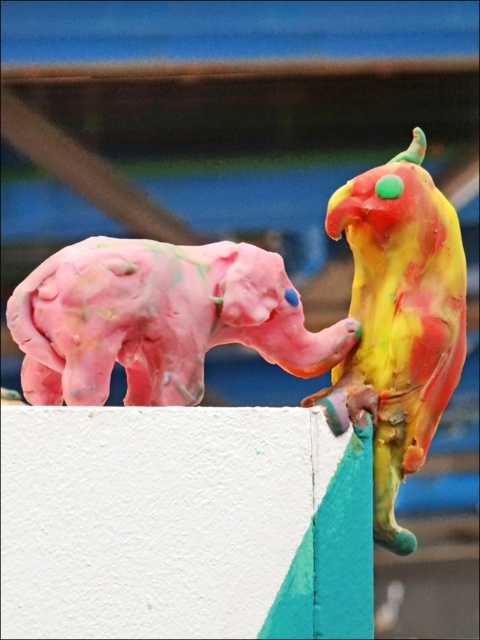
You are examining two points in the image of the sculptures. Which point, point (254, 252) or point (332, 205), is nearer to the camera?

Point (254, 252) is closer to the camera than point (332, 205).

You are an art student analyzing the placement of sculptures in the image. The image has a pink elephant sculpture and a point marked at coordinates (276, 321). Which object is located at the specified coordinates?

The point at coordinates (276, 321) corresponds to the matte clay elephant at upper left.

You are standing in front of the two sculptures and want to touch the closest point to you. Which point should you reach for, point A at coordinates point A is point (392, 342) or point B at coordinates point B is point (164, 310)?

Point A at coordinates point A is point (392, 342) is further to the camera than point B at coordinates point B is point (164, 310), so you should reach for point B at coordinates point B is point (164, 310) as it is closer to you.